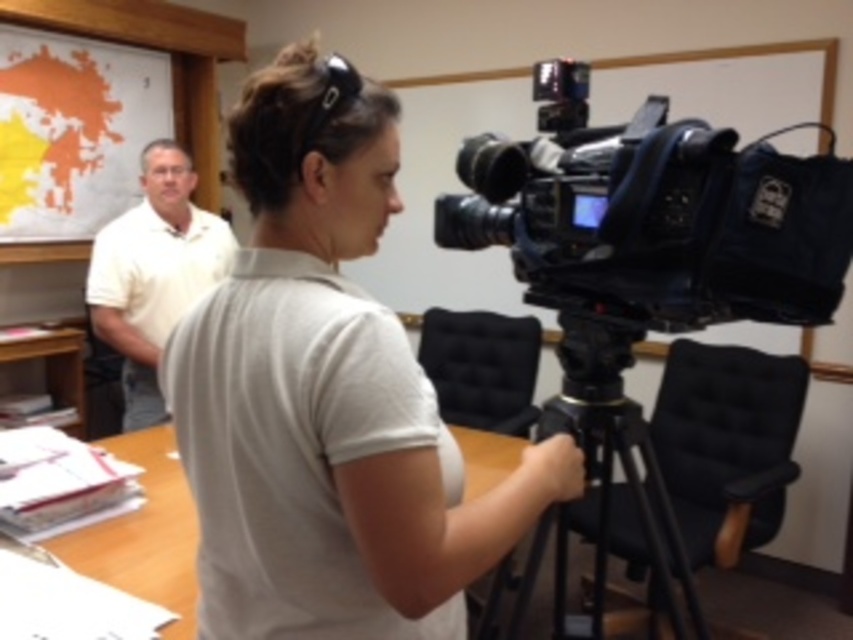
You are the camera operator in the scene. You need to move the black plastic video camera at center to the wooden table at center. Is the camera currently behind or in front of the table?

The black plastic video camera at center is in front of the wooden table at center, so it is currently in front of the table.

Consider the image. You are setting up equipment for a video shoot. You have two cameras in front of you, the black plastic video camera at center and the black plastic camera at center. Which one is taller?

The black plastic video camera at center is taller than the black plastic camera at center.

You are a technician who needs to adjust the focus of the black plastic video camera at center. The manual states that the optimal focusing distance is between 1.2 meters and 2.5 meters. Based on the scene description, can you focus on the person in the background?

The distance between the black plastic video camera at center and the camera is 1.04 meters, which is below the minimum focusing distance of 1.2 meters. Therefore, the technician cannot focus on the person in the background with the current setup.